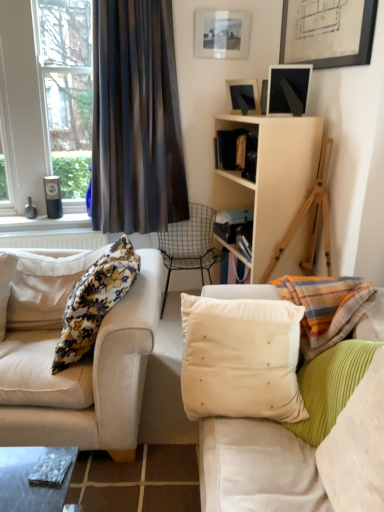
Question: From the image's perspective, does matte black picture frame at upper center, the second picture frame positioned from the top, appear higher than floral fabric pillow at left, positioned as the 3th pillow in right-to-left order?

Choices:
 (A) no
 (B) yes

Answer: (B)

Question: Does matte black picture frame at upper center, placed as the second picture frame when sorted from bottom to top, have a lesser height compared to floral fabric pillow at left, positioned as the 3th pillow in right-to-left order?

Choices:
 (A) yes
 (B) no

Answer: (A)

Question: Would you say floral fabric pillow at left, positioned as the 1th pillow in left-to-right order, is part of matte black picture frame at upper center, the second picture frame positioned from the top,'s contents?

Choices:
 (A) no
 (B) yes

Answer: (A)

Question: Is floral fabric pillow at left, positioned as the 3th pillow in right-to-left order, at the back of matte black picture frame at upper center, the second picture frame positioned from the top?

Choices:
 (A) yes
 (B) no

Answer: (B)

Question: Is matte black picture frame at upper center, the second picture frame positioned from the top, facing towards floral fabric pillow at left, positioned as the 1th pillow in left-to-right order?

Choices:
 (A) yes
 (B) no

Answer: (B)

Question: From a real-world perspective, relative to floral fabric pillow at left, positioned as the 1th pillow in left-to-right order, is white plastic radiator at lower left vertically above or below?

Choices:
 (A) below
 (B) above

Answer: (A)

Question: In terms of height, does white plastic radiator at lower left look taller or shorter compared to floral fabric pillow at left, positioned as the 1th pillow in left-to-right order?

Choices:
 (A) short
 (B) tall

Answer: (A)

Question: Considering the relative positions of white plastic radiator at lower left and floral fabric pillow at left, positioned as the 3th pillow in right-to-left order, in the image provided, is white plastic radiator at lower left to the left or to the right of floral fabric pillow at left, positioned as the 3th pillow in right-to-left order,?

Choices:
 (A) left
 (B) right

Answer: (A)

Question: Looking at their shapes, would you say white plastic radiator at lower left is wider or thinner than floral fabric pillow at left, positioned as the 3th pillow in right-to-left order?

Choices:
 (A) thin
 (B) wide

Answer: (A)

Question: From the image's perspective, is beige velvet cushion at center, the second pillow in the right-to-left sequence, located above or below matte glass picture frame at upper center, arranged as the third picture frame when ordered from the bottom?

Choices:
 (A) above
 (B) below

Answer: (B)

Question: Looking at their shapes, would you say beige velvet cushion at center, the 2th pillow positioned from the left, is wider or thinner than matte glass picture frame at upper center, arranged as the third picture frame when ordered from the bottom?

Choices:
 (A) wide
 (B) thin

Answer: (A)

Question: From their relative heights in the image, would you say beige velvet cushion at center, the 2th pillow positioned from the left, is taller or shorter than matte glass picture frame at upper center, the 1th picture frame in the top-to-bottom sequence?

Choices:
 (A) tall
 (B) short

Answer: (A)

Question: In the image, is beige velvet cushion at center, the 2th pillow positioned from the left, on the left side or the right side of matte glass picture frame at upper center, arranged as the third picture frame when ordered from the bottom?

Choices:
 (A) left
 (B) right

Answer: (A)

Question: From the image's perspective, is dark sheer curtain at left above or below matte black picture frame at upper center, the second picture frame positioned from the top?

Choices:
 (A) above
 (B) below

Answer: (B)

Question: Is dark sheer curtain at left to the left or to the right of matte black picture frame at upper center, the second picture frame positioned from the top, in the image?

Choices:
 (A) right
 (B) left

Answer: (B)